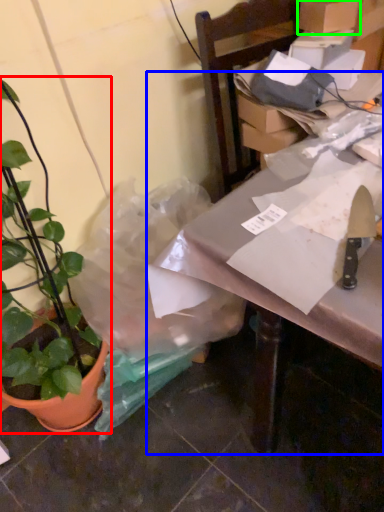
Question: Which object is the farthest from houseplant (highlighted by a red box)? Choose among these: table (highlighted by a blue box) or cardboard box (highlighted by a green box).

Choices:
 (A) table
 (B) cardboard box

Answer: (B)